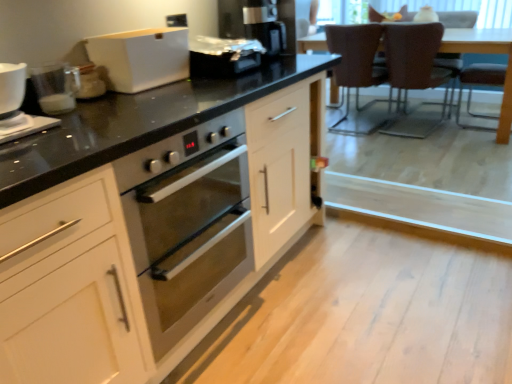
This screenshot has width=512, height=384. What do you see at coordinates (223, 56) in the screenshot? I see `satin black toaster at upper center, marked as the 1th appliance in a back-to-front arrangement` at bounding box center [223, 56].

This screenshot has height=384, width=512. Identify the location of satin black toaster at upper center, which appears as the first appliance when viewed from the top. (223, 56).

Describe the element at coordinates (17, 106) in the screenshot. I see `white glossy bowl at left, which appears as the second appliance when viewed from the back` at that location.

Find the location of a particular element. The width and height of the screenshot is (512, 384). brown leather armchair at upper right, marked as the 1th armchair in a back-to-front arrangement is located at coordinates (458, 19).

Describe the element at coordinates (458, 19) in the screenshot. I see `brown leather armchair at upper right, which is counted as the second armchair, starting from the front` at that location.

The image size is (512, 384). Find the location of `satin black coffee machine at upper center`. satin black coffee machine at upper center is located at coordinates tap(259, 22).

Is the depth of white glossy bowl at left, placed as the second appliance when sorted from top to bottom, less than that of brown leather chair at upper right, which is the second chair in left-to-right order?

Yes, white glossy bowl at left, placed as the second appliance when sorted from top to bottom, is closer to the viewer.

Between white glossy bowl at left, which appears as the second appliance when viewed from the front, and brown leather chair at upper right, acting as the 1th chair starting from the right, which one has smaller size?

white glossy bowl at left, which appears as the second appliance when viewed from the front, is smaller.

How different are the orientations of white glossy bowl at left, which appears as the second appliance when viewed from the front, and brown leather chair at upper right, which is the second chair in left-to-right order, in degrees?

89.4 degrees separate the facing orientations of white glossy bowl at left, which appears as the second appliance when viewed from the front, and brown leather chair at upper right, which is the second chair in left-to-right order.

Which of these two, white glossy bowl at left, which appears as the second appliance when viewed from the front, or brown leather chair at upper right, acting as the 1th chair starting from the right, stands taller?

brown leather chair at upper right, acting as the 1th chair starting from the right, is taller.

Considering the points (208, 36) and (364, 84), which point is in front, point (208, 36) or point (364, 84)?

The point (208, 36) is closer.

Is satin black toaster at upper center, marked as the 1th appliance in a back-to-front arrangement, to the left of brown leather chair at upper right, which is counted as the 2th chair, starting from the right, from the viewer's perspective?

Yes, satin black toaster at upper center, marked as the 1th appliance in a back-to-front arrangement, is to the left of brown leather chair at upper right, which is counted as the 2th chair, starting from the right.

Can you confirm if satin black toaster at upper center, marked as the 1th appliance in a back-to-front arrangement, is wider than brown leather chair at upper right, marked as the 1th chair in a left-to-right arrangement?

Incorrect, the width of satin black toaster at upper center, marked as the 1th appliance in a back-to-front arrangement, does not surpass that of brown leather chair at upper right, marked as the 1th chair in a left-to-right arrangement.

Who is shorter, satin black toaster at upper center, which appears as the first appliance when viewed from the top, or brown leather chair at upper right, which is counted as the 2th chair, starting from the right?

satin black toaster at upper center, which appears as the first appliance when viewed from the top.

Is brown leather armchair at upper right, which is counted as the second armchair, starting from the front, facing away from white matte cabinet at center?

No.

Who is smaller, brown leather armchair at upper right, which is counted as the second armchair, starting from the front, or white matte cabinet at center?

Smaller between the two is brown leather armchair at upper right, which is counted as the second armchair, starting from the front.

Find the location of a particular element. This screenshot has height=384, width=512. cabinetry below the brown leather armchair at upper right, which is counted as the second armchair, starting from the front (from a real-world perspective) is located at coordinates (149, 223).

Can you confirm if satin black coffee machine at upper center is shorter than white matte bread bin at upper center?

In fact, satin black coffee machine at upper center may be taller than white matte bread bin at upper center.

Consider the image. From the image's perspective, between satin black coffee machine at upper center and white matte bread bin at upper center, which one is located above?

Answer: From the image's view, satin black coffee machine at upper center is above.

Consider the image. Is satin black coffee machine at upper center placed right next to white matte bread bin at upper center?

No, satin black coffee machine at upper center is not making contact with white matte bread bin at upper center.

Which of these two, satin black coffee machine at upper center or white matte bread bin at upper center, is smaller?

white matte bread bin at upper center.

Considering the relative positions of white matte bread bin at upper center and satin black toaster at upper center, which is the 3th appliance in front-to-back order, in the image provided, is white matte bread bin at upper center in front of satin black toaster at upper center, which is the 3th appliance in front-to-back order,?

Yes, white matte bread bin at upper center is closer to the viewer.

Does white matte bread bin at upper center appear on the left side of satin black toaster at upper center, the 3th appliance in the bottom-to-top sequence?

Correct, you'll find white matte bread bin at upper center to the left of satin black toaster at upper center, the 3th appliance in the bottom-to-top sequence.

Does white matte bread bin at upper center contain satin black toaster at upper center, the 3th appliance in the bottom-to-top sequence?

Definitely not — satin black toaster at upper center, the 3th appliance in the bottom-to-top sequence, is not inside white matte bread bin at upper center.

From the image's perspective, does white glossy plate at left, positioned as the first appliance in left-to-right order, appear higher than brown leather armchair at upper right, marked as the 1th armchair in a back-to-front arrangement?

Incorrect, from the image's perspective, white glossy plate at left, positioned as the first appliance in left-to-right order, is lower than brown leather armchair at upper right, marked as the 1th armchair in a back-to-front arrangement.

Does white glossy plate at left, which is the third appliance from back to front, have a greater width compared to brown leather armchair at upper right, marked as the 1th armchair in a back-to-front arrangement?

No.

Which object is further away from the camera taking this photo, white glossy plate at left, positioned as the first appliance in left-to-right order, or brown leather armchair at upper right, which is counted as the second armchair, starting from the front?

brown leather armchair at upper right, which is counted as the second armchair, starting from the front.

Is brown leather chair at upper right, acting as the 1th chair starting from the right, aimed at satin black coffee machine at upper center?

No.

Is brown leather chair at upper right, which is the second chair in left-to-right order, in front of or behind satin black coffee machine at upper center in the image?

In the image, brown leather chair at upper right, which is the second chair in left-to-right order, appears behind satin black coffee machine at upper center.

In the scene shown: From the image's perspective, is brown leather chair at upper right, which is the second chair in left-to-right order, located above or below satin black coffee machine at upper center?

Clearly, from the image's perspective, brown leather chair at upper right, which is the second chair in left-to-right order, is above satin black coffee machine at upper center.

Considering the positions of objects brown leather chair at upper right, acting as the 1th chair starting from the right, and satin black coffee machine at upper center in the image provided, who is more to the right, brown leather chair at upper right, acting as the 1th chair starting from the right, or satin black coffee machine at upper center?

Positioned to the right is brown leather chair at upper right, acting as the 1th chair starting from the right.

Starting from the white glossy bowl at left, the 2th appliance from the left, which chair is the 1st one behind? Please provide its 2D coordinates.

[(414, 73)]

From a real-world perspective, starting from the satin black toaster at upper center, the 3th appliance in the bottom-to-top sequence, which chair is the 2nd one below it? Please provide its 2D coordinates.

[(358, 71)]

When comparing their distances from brown leather chair at upper right, which is the second chair in left-to-right order, does white matte cabinet at center or satin black coffee machine at upper center seem further?

white matte cabinet at center is positioned further to the anchor brown leather chair at upper right, which is the second chair in left-to-right order.

Looking at this image, from the image, which object appears to be farther from white matte cabinet at center, satin black toaster at upper center, which is the 3th appliance from left to right, or brown leather chair at upper right, which is the second chair in left-to-right order?

brown leather chair at upper right, which is the second chair in left-to-right order, is positioned further to the anchor white matte cabinet at center.

From the image, which object appears to be nearer to brown leather chair at upper right, marked as the 1th chair in a left-to-right arrangement, white glossy mug at left or brown leather armchair at right, positioned as the 2th armchair in back-to-front order?

brown leather armchair at right, positioned as the 2th armchair in back-to-front order.

Consider the image. When comparing their distances from brown leather chair at upper right, marked as the 1th chair in a left-to-right arrangement, does white matte bread bin at upper center or brown leather armchair at right, positioned as the 2th armchair in back-to-front order, seem closer?

Among the two, brown leather armchair at right, positioned as the 2th armchair in back-to-front order, is located nearer to brown leather chair at upper right, marked as the 1th chair in a left-to-right arrangement.

Estimate the real-world distances between objects in this image. Which object is closer to brown leather chair at upper right, which is the second chair in left-to-right order, white matte bread bin at upper center or brown leather armchair at upper right, marked as the 1th armchair in a back-to-front arrangement?

Among the two, brown leather armchair at upper right, marked as the 1th armchair in a back-to-front arrangement, is located nearer to brown leather chair at upper right, which is the second chair in left-to-right order.

Which object lies further to the anchor point white glossy bowl at left, placed as the second appliance when sorted from top to bottom, brown leather armchair at upper right, which is counted as the second armchair, starting from the front, or brown leather armchair at right, positioned as the 2th armchair in back-to-front order?

brown leather armchair at right, positioned as the 2th armchair in back-to-front order, is positioned further to the anchor white glossy bowl at left, placed as the second appliance when sorted from top to bottom.

Considering their positions, is white glossy plate at left, arranged as the 3th appliance when viewed from the top, positioned further to white glossy bowl at left, which appears as the second appliance when viewed from the front, than satin black coffee machine at upper center?

The object further to white glossy bowl at left, which appears as the second appliance when viewed from the front, is satin black coffee machine at upper center.

Considering their positions, is white matte bread bin at upper center positioned further to white matte cabinet at center than satin black toaster at upper center, acting as the 1th appliance starting from the right?

Among the two, satin black toaster at upper center, acting as the 1th appliance starting from the right, is located further to white matte cabinet at center.

Locate an element on the screen. This screenshot has height=384, width=512. armchair between white glossy bowl at left, the second appliance from the right, and brown leather armchair at right, positioned as the 2th armchair in back-to-front order is located at coordinates (458, 19).

You are a GUI agent. You are given a task and a screenshot of the screen. Output one action in this format:
    pyautogui.click(x=<x>, y=<y>)
    Task: Click on the coffee machine between white matte cabinet at center and brown leather armchair at right, positioned as the 2th armchair in back-to-front order, in the horizontal direction
    The width and height of the screenshot is (512, 384).
    Given the screenshot: What is the action you would take?
    pyautogui.click(x=259, y=22)

Find the location of a particular element. cabinetry located between white glossy bowl at left, arranged as the second appliance when ordered from the bottom, and brown leather armchair at right, placed as the 1th armchair when sorted from front to back, in the left-right direction is located at coordinates tap(149, 223).

Identify the location of chair between white glossy plate at left, the first appliance when ordered from front to back, and brown leather chair at upper right, which is counted as the 2th chair, starting from the right, along the z-axis. (414, 73).